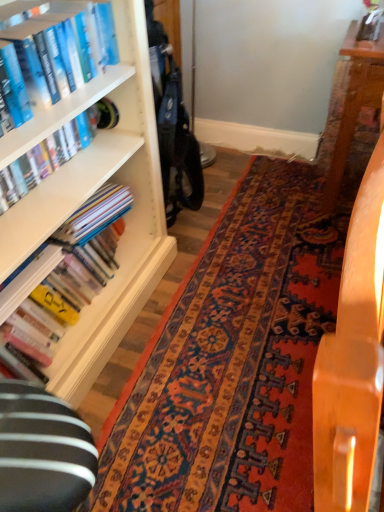
Question: Should I look upward or downward to see hardcover book at left, the 2th book when ordered from top to bottom?

Choices:
 (A) up
 (B) down

Answer: (A)

Question: Considering the relative sizes of blue hardcover book at upper left, acting as the first book starting from the top, and hardcover book at left, which is counted as the 2th book, starting from the bottom, in the image provided, is blue hardcover book at upper left, acting as the first book starting from the top, taller than hardcover book at left, which is counted as the 2th book, starting from the bottom,?

Choices:
 (A) no
 (B) yes

Answer: (B)

Question: Is blue hardcover book at upper left, which is the third book from bottom to top, shorter than hardcover book at left, which is counted as the 2th book, starting from the bottom?

Choices:
 (A) yes
 (B) no

Answer: (B)

Question: From a real-world perspective, is blue hardcover book at upper left, acting as the first book starting from the top, on hardcover book at left, which is counted as the 2th book, starting from the bottom?

Choices:
 (A) yes
 (B) no

Answer: (A)

Question: Is blue hardcover book at upper left, which is the third book from bottom to top, thinner than hardcover book at left, which is counted as the 2th book, starting from the bottom?

Choices:
 (A) no
 (B) yes

Answer: (A)

Question: From a real-world perspective, is blue hardcover book at upper left, which is the third book from bottom to top, physically below hardcover book at left, the 2th book when ordered from top to bottom?

Choices:
 (A) no
 (B) yes

Answer: (A)

Question: Is blue hardcover book at upper left, which is the third book from bottom to top, aimed at hardcover book at left, which is counted as the 2th book, starting from the bottom?

Choices:
 (A) yes
 (B) no

Answer: (B)

Question: Is blue hardcover book at upper left, which is the third book from bottom to top, positioned behind wooden table at center?

Choices:
 (A) no
 (B) yes

Answer: (B)

Question: From the image's perspective, is blue hardcover book at upper left, which is the third book from bottom to top, over wooden table at center?

Choices:
 (A) yes
 (B) no

Answer: (A)

Question: From a real-world perspective, is blue hardcover book at upper left, which is the third book from bottom to top, under wooden table at center?

Choices:
 (A) yes
 (B) no

Answer: (B)

Question: Can you confirm if blue hardcover book at upper left, which is the third book from bottom to top, is bigger than wooden table at center?

Choices:
 (A) yes
 (B) no

Answer: (B)

Question: Considering the relative sizes of blue hardcover book at upper left, acting as the first book starting from the top, and wooden table at center in the image provided, is blue hardcover book at upper left, acting as the first book starting from the top, taller than wooden table at center?

Choices:
 (A) no
 (B) yes

Answer: (A)

Question: Is blue hardcover book at upper left, which is the third book from bottom to top, not inside wooden table at center?

Choices:
 (A) no
 (B) yes

Answer: (B)

Question: Is the position of hardcover book at left, the 2th book when ordered from top to bottom, more distant than that of carpet with intricate patterns at center?

Choices:
 (A) no
 (B) yes

Answer: (B)